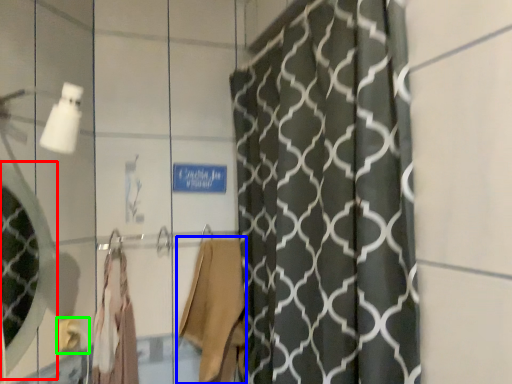
Question: Considering the real-world distances, which object is farthest from mirror (highlighted by a red box)? robe (highlighted by a blue box) or towel bar (highlighted by a green box)?

Choices:
 (A) robe
 (B) towel bar

Answer: (A)